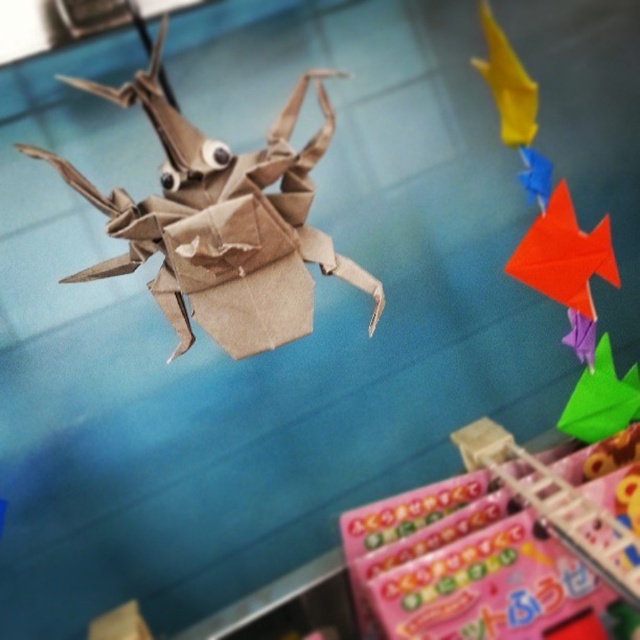
Question: Is brown paper origami crab at center wider than yellow paper fish at upper right?

Choices:
 (A) no
 (B) yes

Answer: (B)

Question: Which of these objects is positioned farthest from the brown paper origami crab at center?

Choices:
 (A) orange paper fish at upper right
 (B) yellow paper fish at upper right

Answer: (B)

Question: Which object appears farthest from the camera in this image?

Choices:
 (A) brown paper origami crab at center
 (B) yellow paper fish at upper right

Answer: (B)

Question: Is brown paper origami crab at center to the right of orange paper fish at upper right from the viewer's perspective?

Choices:
 (A) yes
 (B) no

Answer: (B)

Question: Which object appears closest to the camera in this image?

Choices:
 (A) brown paper origami crab at center
 (B) orange paper fish at upper right

Answer: (A)

Question: Is orange paper fish at upper right above yellow paper fish at upper right?

Choices:
 (A) no
 (B) yes

Answer: (A)